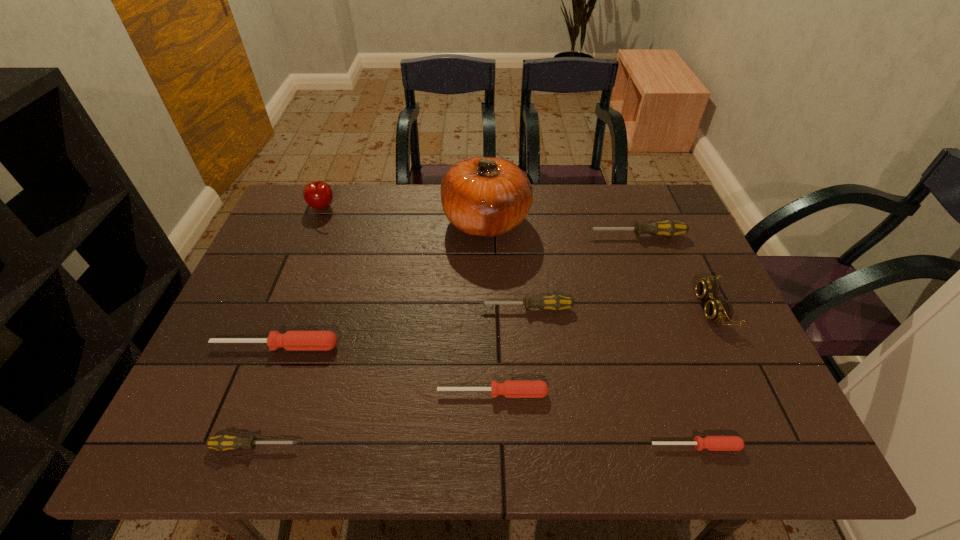
Locate which screwdriver ranks fourth in proximity to the second smallest red screwdriver. Please provide its 2D coordinates. Your answer should be formatted as a tuple, i.e. [(x, y)], where the tuple contains the x and y coordinates of a point satisfying the conditions above.

[(223, 442)]

Find the location of `gray screwdriver that stands as the second closest to the fifth nearest screwdriver`. gray screwdriver that stands as the second closest to the fifth nearest screwdriver is located at coordinates (223, 442).

Locate an element on the screen. The height and width of the screenshot is (540, 960). the second closest gray screwdriver to the rightmost red screwdriver is located at coordinates (669, 228).

Locate which red screwdriver ranks second in proximity to the second smallest gray screwdriver. Please provide its 2D coordinates. Your answer should be formatted as a tuple, i.e. [(x, y)], where the tuple contains the x and y coordinates of a point satisfying the conditions above.

[(713, 443)]

I want to click on the closest red screwdriver relative to the eighth shortest object, so click(x=292, y=340).

This screenshot has width=960, height=540. What are the coordinates of `vacant space that satisfies the following two spatial constraints: 1. on the front side of the second tallest object; 2. on the left side of the farthest red screwdriver` in the screenshot? It's located at (269, 346).

You are a GUI agent. You are given a task and a screenshot of the screen. Output one action in this format:
    pyautogui.click(x=<x>, y=<y>)
    Task: Click on the vacant area that satisfies the following two spatial constraints: 1. at the tip of the second farthest gray screwdriver; 2. on the right side of the nearest red screwdriver
    
    Given the screenshot: What is the action you would take?
    pyautogui.click(x=540, y=446)

Identify the location of vacant space that satisfies the following two spatial constraints: 1. at the tip of the second gray screwdriver from left to right; 2. on the front side of the second biggest red screwdriver. (534, 393).

The height and width of the screenshot is (540, 960). In order to click on vacant position in the image that satisfies the following two spatial constraints: 1. on the front side of the cherry; 2. on the left side of the shortest object in this screenshot , I will do `click(228, 446)`.